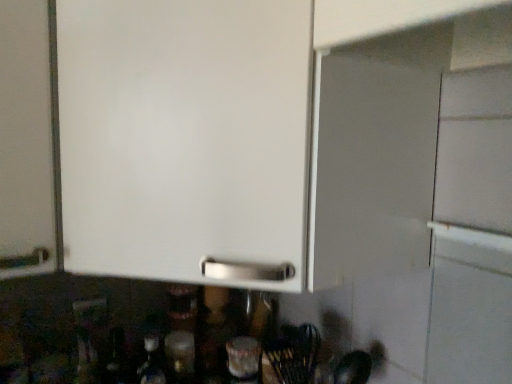
What do you see at coordinates (181, 332) in the screenshot? This screenshot has width=512, height=384. I see `translucent glass bottle at lower center` at bounding box center [181, 332].

Find the location of a particular element. The width and height of the screenshot is (512, 384). translucent glass bottle at lower center is located at coordinates (181, 332).

What do you see at coordinates (89, 311) in the screenshot?
I see `matte white outlet at lower left` at bounding box center [89, 311].

Locate an element on the screen. Image resolution: width=512 pixels, height=384 pixels. matte white outlet at lower left is located at coordinates (89, 311).

At what (x,y) coordinates should I click in order to perform the action: click on translucent glass bottle at lower center. Please return your answer as a coordinate pair (x, y). Looking at the image, I should click on (181, 332).

Considering the relative positions of translucent glass bottle at lower center and matte white outlet at lower left in the image provided, is translucent glass bottle at lower center to the right of matte white outlet at lower left from the viewer's perspective?

Yes.

Which is in front, translucent glass bottle at lower center or matte white outlet at lower left?

matte white outlet at lower left is in front.

Does point (180, 308) come behind point (82, 304)?

Yes, point (180, 308) is farther from viewer.

From the image's perspective, is translucent glass bottle at lower center located above or below matte white outlet at lower left?

translucent glass bottle at lower center is situated lower than matte white outlet at lower left in the image.

From a real-world perspective, which is physically above, translucent glass bottle at lower center or matte white outlet at lower left?

From a 3D spatial view, matte white outlet at lower left is above.

Which object is thinner, translucent glass bottle at lower center or matte white outlet at lower left?

Thinner between the two is matte white outlet at lower left.

Considering the relative sizes of translucent glass bottle at lower center and matte white outlet at lower left in the image provided, is translucent glass bottle at lower center shorter than matte white outlet at lower left?

No, translucent glass bottle at lower center is not shorter than matte white outlet at lower left.

Considering the sizes of objects translucent glass bottle at lower center and matte white outlet at lower left in the image provided, who is bigger, translucent glass bottle at lower center or matte white outlet at lower left?

translucent glass bottle at lower center.

Can we say translucent glass bottle at lower center lies outside matte white outlet at lower left?

Absolutely, translucent glass bottle at lower center is external to matte white outlet at lower left.

Is translucent glass bottle at lower center next to matte white outlet at lower left and touching it?

translucent glass bottle at lower center and matte white outlet at lower left are not in contact.

Could you tell me if translucent glass bottle at lower center is facing matte white outlet at lower left?

No.

Can you tell me how much translucent glass bottle at lower center and matte white outlet at lower left differ in facing direction?

The angle between the facing direction of translucent glass bottle at lower center and the facing direction of matte white outlet at lower left is 0.966 degrees.

How much distance is there between translucent glass bottle at lower center and matte white outlet at lower left?

They are 8.32 inches apart.

You are a GUI agent. You are given a task and a screenshot of the screen. Output one action in this format:
    pyautogui.click(x=<x>, y=<y>)
    Task: Click on the bottle that appears on the right of matte white outlet at lower left
    The image size is (512, 384).
    Given the screenshot: What is the action you would take?
    pyautogui.click(x=181, y=332)

Considering the relative positions of matte white outlet at lower left and translucent glass bottle at lower center in the image provided, is matte white outlet at lower left to the right of translucent glass bottle at lower center from the viewer's perspective?

No, matte white outlet at lower left is not to the right of translucent glass bottle at lower center.

Which is in front, matte white outlet at lower left or translucent glass bottle at lower center?

matte white outlet at lower left is closer to the camera.

Is point (94, 312) positioned behind point (190, 381)?

That is True.

From the image's perspective, is matte white outlet at lower left above or below translucent glass bottle at lower center?

matte white outlet at lower left is situated higher than translucent glass bottle at lower center in the image.

From a real-world perspective, which is physically below, matte white outlet at lower left or translucent glass bottle at lower center?

translucent glass bottle at lower center, from a real-world perspective.

From the picture: Which of these two, matte white outlet at lower left or translucent glass bottle at lower center, is wider?

translucent glass bottle at lower center.

Considering the sizes of matte white outlet at lower left and translucent glass bottle at lower center in the image, is matte white outlet at lower left taller or shorter than translucent glass bottle at lower center?

matte white outlet at lower left is shorter than translucent glass bottle at lower center.

Does matte white outlet at lower left have a smaller size compared to translucent glass bottle at lower center?

Correct, matte white outlet at lower left occupies less space than translucent glass bottle at lower center.

Is matte white outlet at lower left completely or partially outside of translucent glass bottle at lower center?

Yes, matte white outlet at lower left is not within translucent glass bottle at lower center.

Is there a large distance between matte white outlet at lower left and translucent glass bottle at lower center?

They are positioned close to each other.

Is translucent glass bottle at lower center at the back of matte white outlet at lower left?

matte white outlet at lower left is not turned away from translucent glass bottle at lower center.

Can you tell me how much matte white outlet at lower left and translucent glass bottle at lower center differ in facing direction?

0.966 degrees separate the facing orientations of matte white outlet at lower left and translucent glass bottle at lower center.

Measure the distance from matte white outlet at lower left to translucent glass bottle at lower center.

The distance of matte white outlet at lower left from translucent glass bottle at lower center is 8.32 inches.

Locate an element on the screen. The height and width of the screenshot is (384, 512). bottle that is under the matte white outlet at lower left (from a real-world perspective) is located at coordinates (181, 332).

I want to click on bottle to the right of matte white outlet at lower left, so click(x=181, y=332).

The image size is (512, 384). Identify the location of bottle that appears below the matte white outlet at lower left (from a real-world perspective). (181, 332).